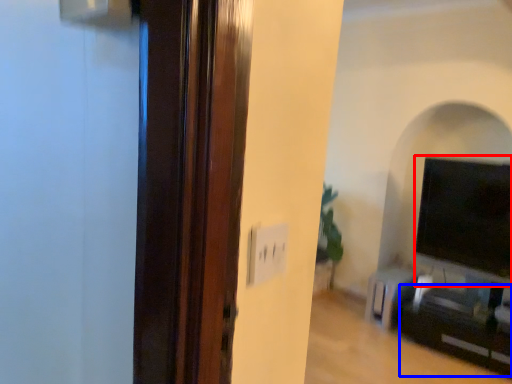
Question: Which of the following is the closest to the observer, wide (highlighted by a red box) or entertainment center (highlighted by a blue box)?

Choices:
 (A) wide
 (B) entertainment center

Answer: (B)